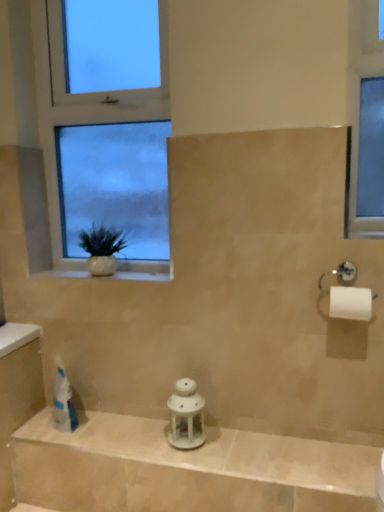
This screenshot has height=512, width=384. Describe the element at coordinates (185, 469) in the screenshot. I see `white glossy lantern at center` at that location.

Find the location of `white matte toilet paper at right`. white matte toilet paper at right is located at coordinates (350, 303).

At what (x,y) coordinates should I click in order to perform the action: click on white glass window at upper left. Please return your answer as a coordinate pair (x, y). Looking at the image, I should click on (77, 116).

This screenshot has width=384, height=512. In order to click on toiletry that appears above the white glossy lantern at center (from a real-world perspective) in this screenshot , I will do `click(186, 415)`.

From the image's perspective, which one is positioned higher, white porcelain lantern at center or white glossy lantern at center?

white porcelain lantern at center.

From a real-world perspective, which object stands above the other?

From a 3D spatial view, white porcelain lantern at center is above.

Locate an element on the screen. The height and width of the screenshot is (512, 384). houseplant that is behind the white glossy lantern at center is located at coordinates (102, 249).

Based on the photo, which of these two, white glossy lantern at center or white ceramic vase at left, is bigger?

white ceramic vase at left is bigger.

Is white glossy lantern at center wider or thinner than white ceramic vase at left?

Considering their sizes, white glossy lantern at center looks broader than white ceramic vase at left.

Would you say white glossy lantern at center contains white ceramic vase at left?

Definitely not — white ceramic vase at left is not inside white glossy lantern at center.

Locate an element on the screen. This screenshot has width=384, height=512. balustrade on the left of the white matte toilet paper at right is located at coordinates (185, 469).

From the image's perspective, which is below, white matte toilet paper at right or white glossy lantern at center?

white glossy lantern at center.

Which is behind, white matte toilet paper at right or white glossy lantern at center?

white matte toilet paper at right is behind.

Looking at this image, is white matte toilet paper at right placed right next to white glossy lantern at center?

They are not placed beside each other.

Would you say white matte toilet paper at right is to the left or to the right of white ceramic vase at left in the picture?

In the image, white matte toilet paper at right appears on the right side of white ceramic vase at left.

From the image's perspective, is white matte toilet paper at right on white ceramic vase at left?

No, from the image's perspective, white matte toilet paper at right is not over white ceramic vase at left.

Would you say white matte toilet paper at right contains white ceramic vase at left?

That's incorrect, white ceramic vase at left is not inside white matte toilet paper at right.

In the image, there is a white ceramic vase at left. Identify the location of toilet paper below it (from the image's perspective). Image resolution: width=384 pixels, height=512 pixels. (350, 303).

Who is smaller, white glass window at upper left or white ceramic vase at left?

With smaller size is white ceramic vase at left.

How far apart are white glass window at upper left and white ceramic vase at left?

10.12 inches.

Is white glass window at upper left far away from white ceramic vase at left?

No, white glass window at upper left is in close proximity to white ceramic vase at left.

Is white glass window at upper left facing away from white ceramic vase at left?

Yes, white glass window at upper left is positioned with its back facing white ceramic vase at left.

From a real-world perspective, is white glass window at upper left physically above white matte toilet paper at right?

Yes, from a real-world perspective, white glass window at upper left is over white matte toilet paper at right

Is the surface of white glass window at upper left in direct contact with white matte toilet paper at right?

They are not placed beside each other.

Is white glass window at upper left oriented towards white matte toilet paper at right?

No, white glass window at upper left is not aimed at white matte toilet paper at right.

Who is smaller, white glass window at upper left or white matte toilet paper at right?

With smaller size is white matte toilet paper at right.

Considering the relative positions of white ceramic vase at left and white glossy lantern at center in the image provided, is white ceramic vase at left to the right of white glossy lantern at center from the viewer's perspective?

In fact, white ceramic vase at left is to the left of white glossy lantern at center.

Are white ceramic vase at left and white glossy lantern at center far apart?

white ceramic vase at left is near white glossy lantern at center, not far away.

Measure the distance between white ceramic vase at left and white glossy lantern at center.

white ceramic vase at left is 28.61 inches away from white glossy lantern at center.

How different are the orientations of white ceramic vase at left and white glossy lantern at center in degrees?

white ceramic vase at left and white glossy lantern at center are facing 1.09e-05 degrees away from each other.

Image resolution: width=384 pixels, height=512 pixels. I want to click on balustrade below the white porcelain lantern at center (from the image's perspective), so click(x=185, y=469).

Where is `balustrade below the white ceramic vase at left (from a real-world perspective)`? This screenshot has height=512, width=384. balustrade below the white ceramic vase at left (from a real-world perspective) is located at coordinates (185, 469).

From the picture: Considering their positions, is white porcelain lantern at center positioned further to white glass window at upper left than white glossy lantern at center?

white glossy lantern at center lies further to white glass window at upper left than the other object.

Based on their spatial positions, is white ceramic vase at left or white ceramic vase at left further from white porcelain lantern at center?

Among the two, white ceramic vase at left is located further to white porcelain lantern at center.

Estimate the real-world distances between objects in this image. Which object is closer to white matte toilet paper at right, white ceramic vase at left or white ceramic vase at left?

white ceramic vase at left is closer to white matte toilet paper at right.

When comparing their distances from white porcelain lantern at center, does white glossy lantern at center or white matte toilet paper at right seem closer?

Among the two, white glossy lantern at center is located nearer to white porcelain lantern at center.

Estimate the real-world distances between objects in this image. Which object is closer to white porcelain lantern at center, white ceramic vase at left or white glass window at upper left?

Based on the image, white ceramic vase at left appears to be nearer to white porcelain lantern at center.

From the image, which object appears to be nearer to white glass window at upper left, white glossy lantern at center or white ceramic vase at left?

white ceramic vase at left lies closer to white glass window at upper left than the other object.

Which object lies further to the anchor point white matte toilet paper at right, white glossy lantern at center or white ceramic vase at left?

white ceramic vase at left is positioned further to the anchor white matte toilet paper at right.

Which object lies further to the anchor point white glossy lantern at center, white matte toilet paper at right or white porcelain lantern at center?

The object further to white glossy lantern at center is white matte toilet paper at right.

I want to click on houseplant between white glass window at upper left and white ceramic vase at left vertically, so click(102, 249).

The image size is (384, 512). In order to click on window sill between white glass window at upper left and white glossy lantern at center vertically in this screenshot , I will do `click(143, 270)`.

In order to click on window sill between white ceramic vase at left and white matte toilet paper at right from left to right in this screenshot , I will do `click(143, 270)`.

I want to click on toiletry between white ceramic vase at left and white glossy lantern at center from top to bottom, so click(186, 415).